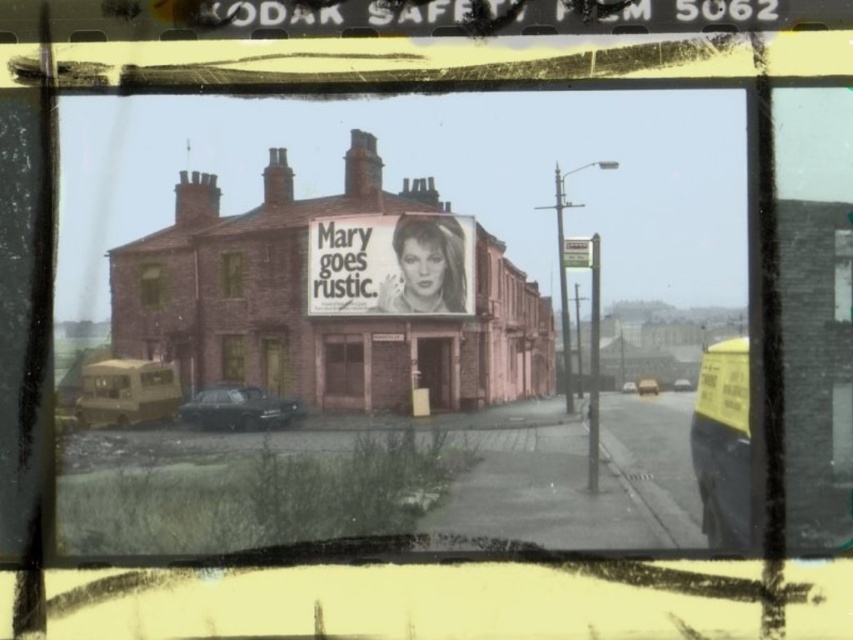
You are a delivery driver who needs to unload a package from your metallic gold van at center. To do so, you must first remove the black and white poster at center that is blocking the van. Is the poster above or below the van?

The black and white poster at center is positioned over metallic gold van at center, so the poster is above the van.

You are a delivery driver who needs to park your vehicle under a low clearance bridge that can only accommodate vehicles up to the height of the metallic silver van at center. You have a metallic gold van at center. Can you safely drive it under the bridge?

The metallic gold van at center is taller than the metallic silver van at center. Since the bridge can only accommodate vehicles up to the height of the metallic silver van at center, the metallic gold van at center cannot safely pass under the bridge.